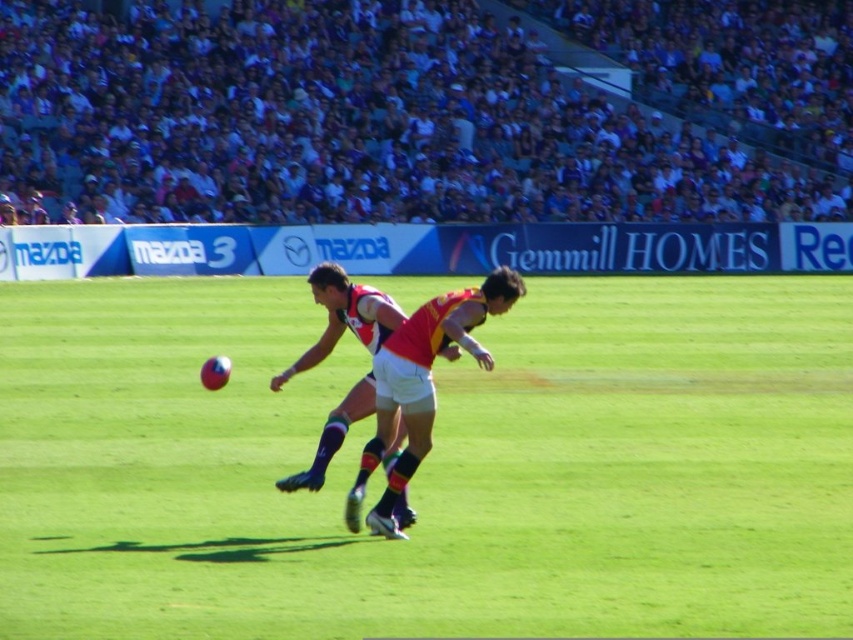
The width and height of the screenshot is (853, 640). What do you see at coordinates (421, 385) in the screenshot?
I see `red jersey at center` at bounding box center [421, 385].

Which is more to the right, red jersey at center or red and white jersey at center?

Positioned to the right is red jersey at center.

Does point (396, 410) come behind point (358, 314)?

No, (396, 410) is closer to viewer.

Find the location of `red jersey at center`. red jersey at center is located at coordinates (421, 385).

Does point (749, 465) come in front of point (386, 314)?

No, it is not.

Does green grass field at center have a greater height compared to red and white jersey at center?

No, green grass field at center is not taller than red and white jersey at center.

Describe the element at coordinates (431, 467) in the screenshot. This screenshot has height=640, width=853. I see `green grass field at center` at that location.

This screenshot has height=640, width=853. Identify the location of green grass field at center. (431, 467).

Which is below, green grass field at center or red jersey at center?

Positioned lower is green grass field at center.

Is green grass field at center positioned before red jersey at center?

Yes.

Identify the location of green grass field at center. (431, 467).